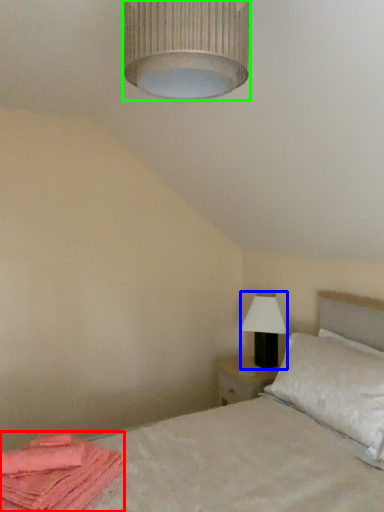
Question: Considering the real-world distances, which object is closest to material (highlighted by a red box)? table lamp (highlighted by a blue box) or lamp (highlighted by a green box).

Choices:
 (A) table lamp
 (B) lamp

Answer: (B)